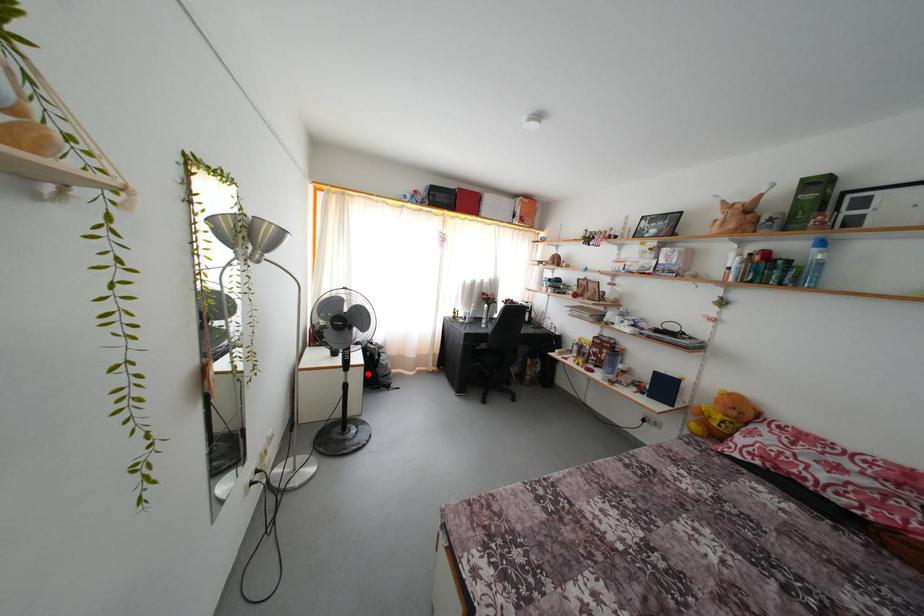
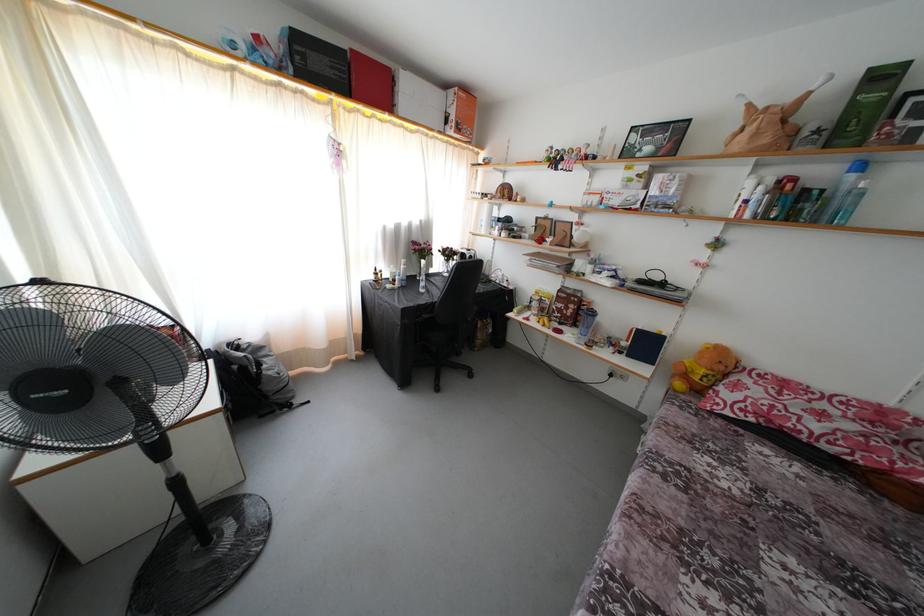
Question: I am providing you with two images of the same scene from different viewpoints. Image1 has a red point marked. In image2, the corresponding 3D location appears at what relative position? Reply with the corresponding letter.

Choices:
 (A) Closer
 (B) Farther

Answer: (B)